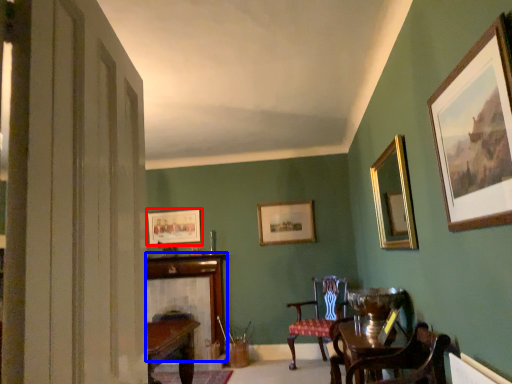
Question: Which object appears closest to the camera in this image, picture frame (highlighted by a red box) or fireplace (highlighted by a blue box)?

Choices:
 (A) picture frame
 (B) fireplace

Answer: (B)